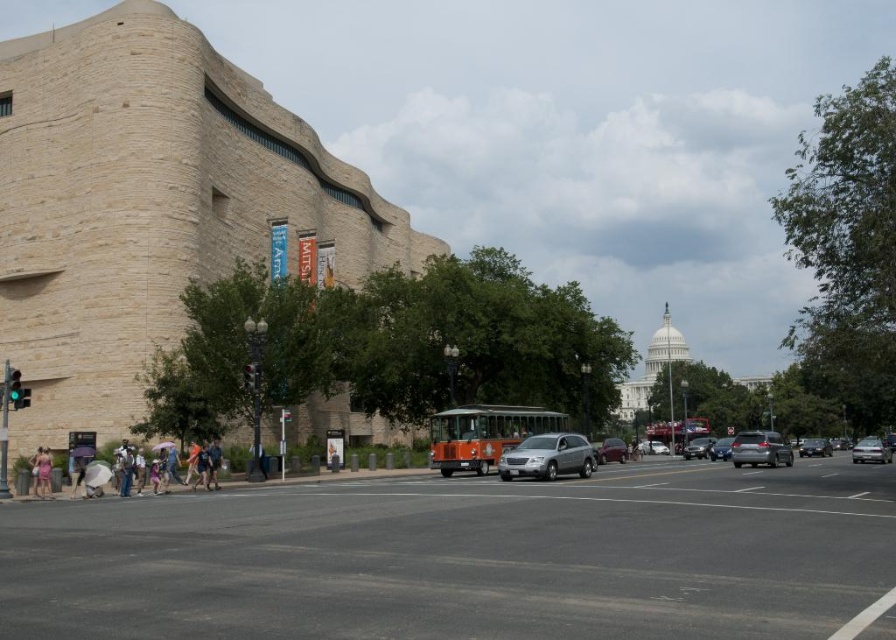
Between metallic silver sedan at center and shiny silver sedan at center, which one appears on the right side from the viewer's perspective?

Positioned to the right is metallic silver sedan at center.

Consider the image. Between metallic silver sedan at center and shiny silver sedan at center, which one appears on the left side from the viewer's perspective?

From the viewer's perspective, shiny silver sedan at center appears more on the left side.

Who is more forward, [854,456] or [608,442]?

Point [854,456] is more forward.

Image resolution: width=896 pixels, height=640 pixels. I want to click on metallic silver sedan at center, so click(x=871, y=451).

Does silver metallic sedan at center lie behind beige fabric umbrella at lower left?

Yes.

Which of these two, silver metallic sedan at center or beige fabric umbrella at lower left, stands taller?

With more height is silver metallic sedan at center.

You are a GUI agent. You are given a task and a screenshot of the screen. Output one action in this format:
    pyautogui.click(x=<x>, y=<y>)
    Task: Click on the silver metallic sedan at center
    
    Given the screenshot: What is the action you would take?
    pyautogui.click(x=547, y=456)

In the scene shown: Is beige fabric umbrella at lower left thinner than pink fabric bag at lower left?

Indeed, beige fabric umbrella at lower left has a lesser width compared to pink fabric bag at lower left.

Can you confirm if beige fabric umbrella at lower left is smaller than pink fabric bag at lower left?

Indeed, beige fabric umbrella at lower left has a smaller size compared to pink fabric bag at lower left.

In the scene shown: Who is more distant from viewer, (37, 490) or (31, 490)?

Positioned behind is point (31, 490).

You are a GUI agent. You are given a task and a screenshot of the screen. Output one action in this format:
    pyautogui.click(x=<x>, y=<y>)
    Task: Click on the beige fabric umbrella at lower left
    
    Given the screenshot: What is the action you would take?
    pyautogui.click(x=42, y=472)